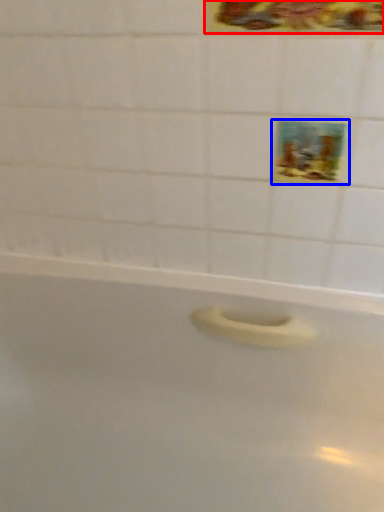
Question: Which object appears closest to the camera in this image, decorative picture (highlighted by a red box) or decorative picture (highlighted by a blue box)?

Choices:
 (A) decorative picture
 (B) decorative picture

Answer: (A)